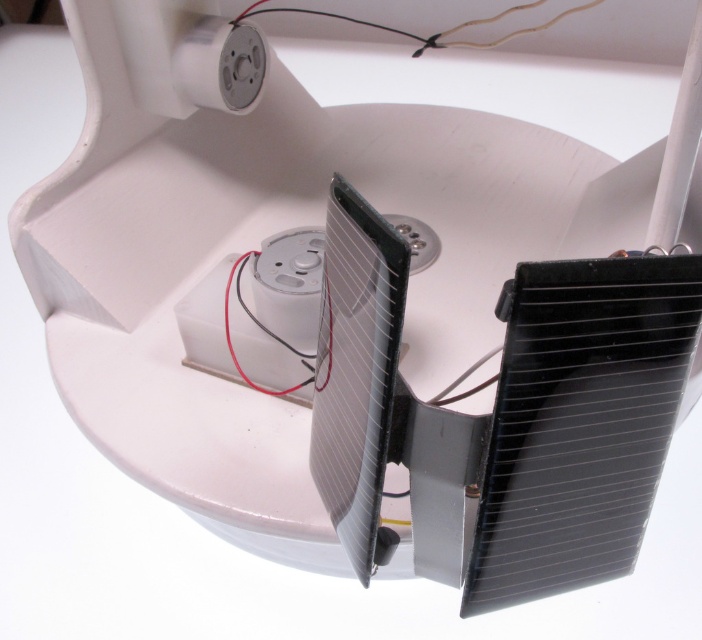
Question: Is metallic silver plug at upper center thinner than black plastic wire at center?

Choices:
 (A) yes
 (B) no

Answer: (B)

Question: Which object appears closest to the camera in this image?

Choices:
 (A) black plastic wire at center
 (B) metallic silver plug at upper center

Answer: (A)

Question: In this image, where is metallic silver plug at upper center located relative to black plastic wire at center?

Choices:
 (A) above
 (B) below

Answer: (A)

Question: Where is metallic silver plug at upper center located in relation to black plastic wire at center in the image?

Choices:
 (A) right
 (B) left

Answer: (B)